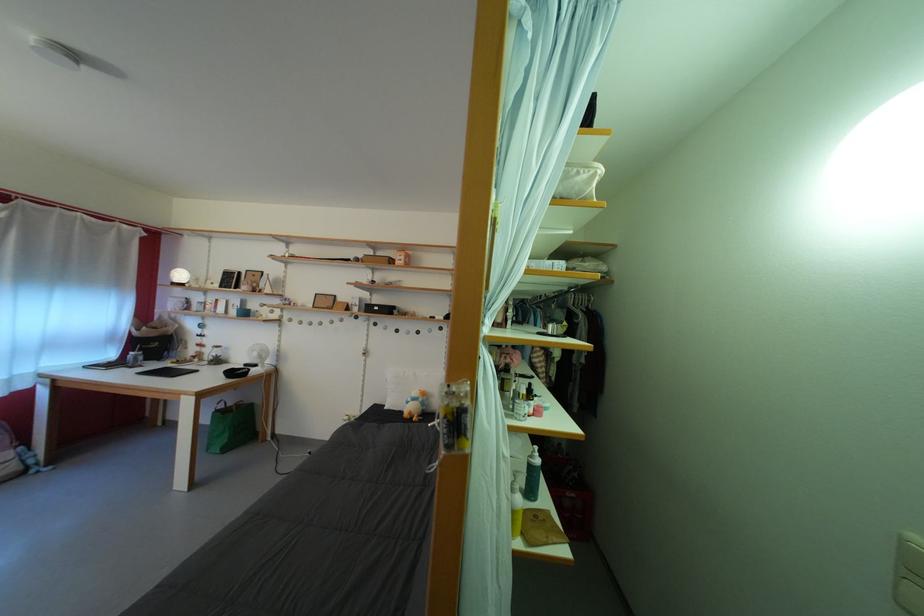
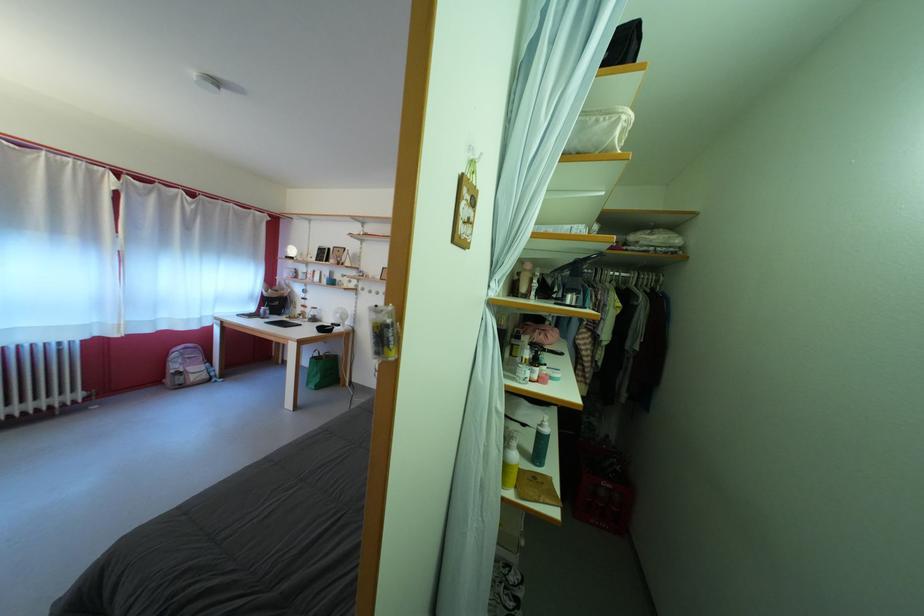
Locate, in the second image, the point that corresponds to point 541,416 in the first image.

(543, 383)